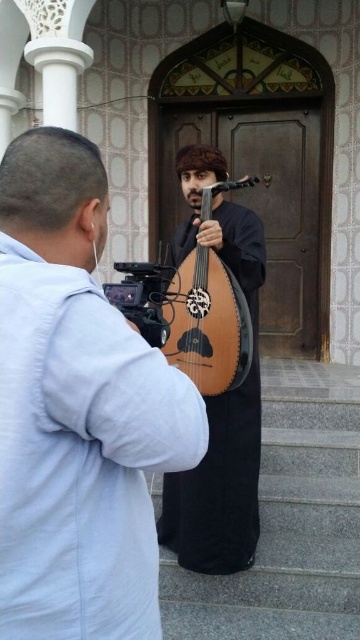
Who is lower down, matte black instrument at center or wooden lute at center?

wooden lute at center is lower down.

Who is higher up, matte black instrument at center or wooden lute at center?

matte black instrument at center

Is point (23, 134) positioned before point (250, 417)?

Yes, point (23, 134) is closer to viewer.

At what (x,y) coordinates should I click in order to perform the action: click on matte black instrument at center. Please return your answer as a coordinate pair (x, y). Image resolution: width=360 pixels, height=640 pixels. Looking at the image, I should click on (77, 410).

Can you confirm if matte black instrument at center is wider than wooden at center?

No, matte black instrument at center is not wider than wooden at center.

Can you confirm if matte black instrument at center is shorter than wooden at center?

No, matte black instrument at center is not shorter than wooden at center.

The height and width of the screenshot is (640, 360). I want to click on matte black instrument at center, so click(x=77, y=410).

Is wooden lute at center below wooden at center?

Yes, wooden lute at center is below wooden at center.

Identify the location of wooden lute at center. (218, 394).